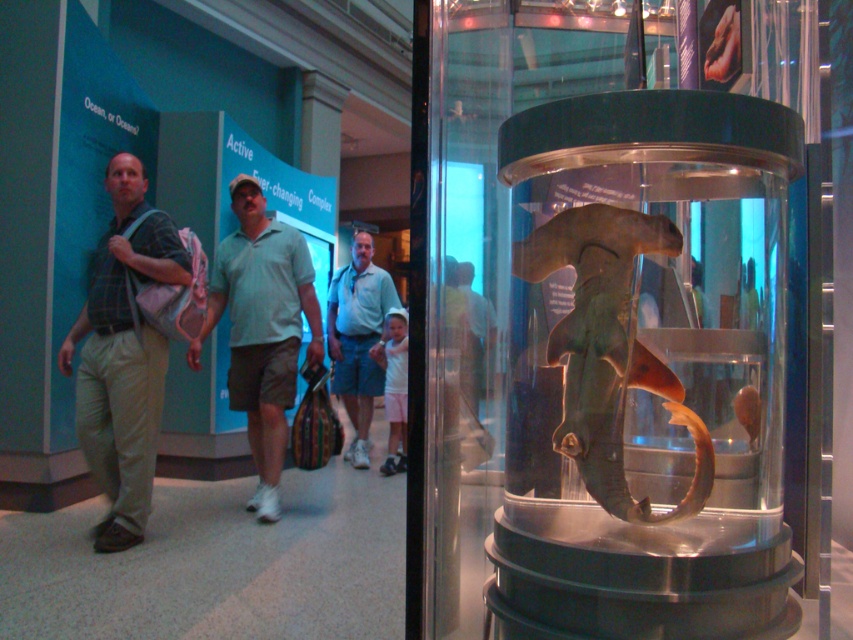
What is located at the point marked by the coordinates (608, 348) in the image?

The point marked by the coordinates (608, 348) marks the translucent green shark at center.

You are standing in front of a museum display case and see the translucent green shark at center. If you were to draw a straight line from your eye level to the shark, what coordinates would you reach on the image plane?

The position of the translucent green shark at center is at point (x=608, y=348) on the image plane.

You are standing in front of the display case with the hammerhead shark. There are two visitors nearby wearing the plaid fabric shirt at left and the light gray cotton polo shirt at center. Which visitor is closer to the display case?

The plaid fabric shirt at left is to the left of the light gray cotton polo shirt at center, so the plaid fabric shirt at left is closer to the display case.